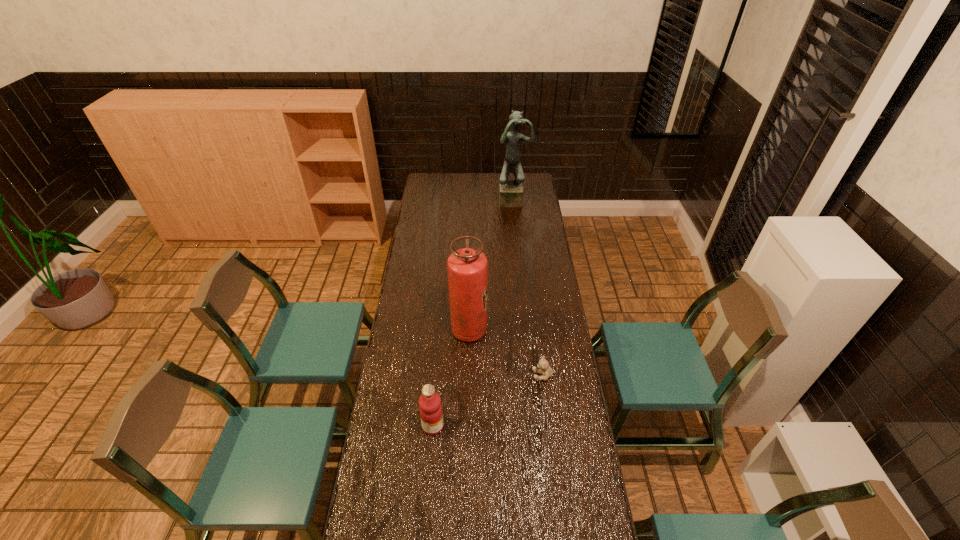
Locate an element on the screen. free space located on the face of the third farthest object is located at coordinates (458, 375).

Where is `vacant region located 0.100m on the face of the third farthest object`? The height and width of the screenshot is (540, 960). vacant region located 0.100m on the face of the third farthest object is located at coordinates (508, 375).

This screenshot has width=960, height=540. I want to click on vacant space located on the face of the third farthest object, so click(438, 375).

Locate an element on the screen. object that is at the far edge is located at coordinates (510, 191).

Where is `sculpture positioned at the right edge`? sculpture positioned at the right edge is located at coordinates (510, 191).

Locate an element on the screen. teddy bear located in the right edge section of the desktop is located at coordinates (543, 365).

Find the location of a particular element. The height and width of the screenshot is (540, 960). object present at the far right corner is located at coordinates (510, 191).

Identify the location of vacant space at the far edge. (476, 179).

Identify the location of vacant space at the left edge of the desktop. This screenshot has width=960, height=540. (386, 476).

In the image, there is a desktop. Identify the location of vacant space at the right edge. (532, 296).